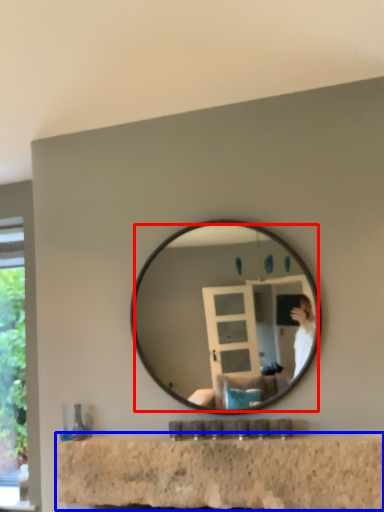
Question: Which object is closer to the camera taking this photo, mirror (highlighted by a red box) or counter top (highlighted by a blue box)?

Choices:
 (A) mirror
 (B) counter top

Answer: (B)